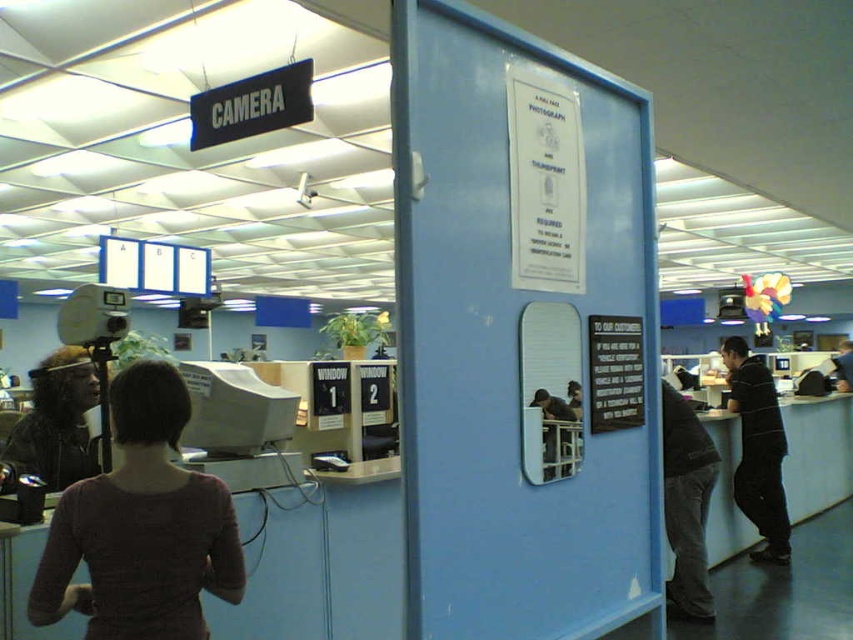
Question: Is dark purple sweater at center positioned in front of black striped shirt at right?

Choices:
 (A) yes
 (B) no

Answer: (A)

Question: Which point is farther from the camera taking this photo?

Choices:
 (A) (216, 500)
 (B) (741, 442)

Answer: (B)

Question: Is dark purple sweater at center bigger than black striped shirt at right?

Choices:
 (A) yes
 (B) no

Answer: (B)

Question: Among these points, which one is farthest from the camera?

Choices:
 (A) (73, 548)
 (B) (727, 384)

Answer: (B)

Question: Can you confirm if dark purple sweater at center is positioned to the left of black striped shirt at right?

Choices:
 (A) no
 (B) yes

Answer: (B)